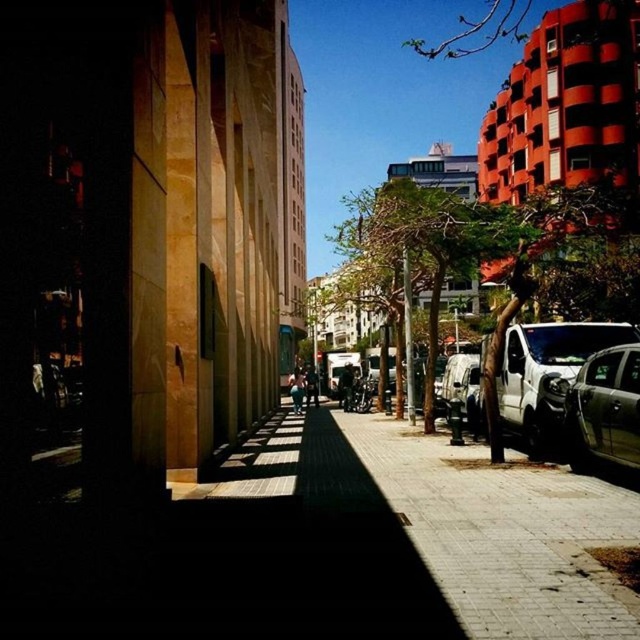
Which of these two, paved stone sidewalk at center or metallic silver van at center, stands taller?

metallic silver van at center is taller.

From the picture: Can you confirm if paved stone sidewalk at center is taller than metallic silver van at center?

In fact, paved stone sidewalk at center may be shorter than metallic silver van at center.

Based on the photo, who is more distant from viewer, (604, 508) or (448, 358)?

Point (448, 358)

Image resolution: width=640 pixels, height=640 pixels. I want to click on paved stone sidewalk at center, so [x=408, y=536].

Who is higher up, metallic silver suv at right or metallic silver van at center?

Positioned higher is metallic silver suv at right.

Measure the distance between point (x=627, y=388) and camera.

7.28 meters

Where is `metallic silver suv at right`? metallic silver suv at right is located at coordinates (604, 410).

Between point (388, 614) and point (504, 381), which one is positioned in front?

Point (388, 614)

Does paved stone sidewalk at center appear on the left side of white matte van at right?

Correct, you'll find paved stone sidewalk at center to the left of white matte van at right.

In order to click on paved stone sidewalk at center in this screenshot , I will do `click(408, 536)`.